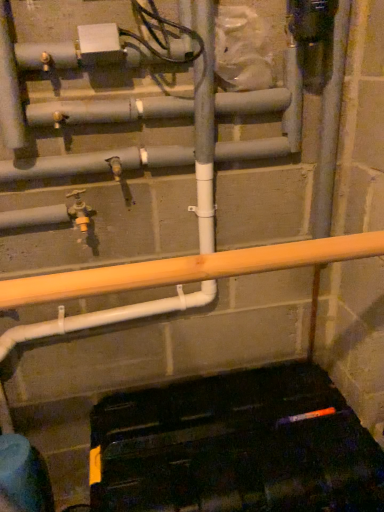
Question: Is gray matte pipe at center looking in the opposite direction of gray matte pipe at center, acting as the 1th pipe starting from the bottom?

Choices:
 (A) no
 (B) yes

Answer: (B)

Question: Is gray matte pipe at center next to gray matte pipe at center, acting as the second pipe starting from the top, and touching it?

Choices:
 (A) no
 (B) yes

Answer: (A)

Question: Is gray matte pipe at center not within gray matte pipe at center, acting as the second pipe starting from the top?

Choices:
 (A) no
 (B) yes

Answer: (B)

Question: From a real-world perspective, is gray matte pipe at center on gray matte pipe at center, acting as the 1th pipe starting from the bottom?

Choices:
 (A) no
 (B) yes

Answer: (A)

Question: Is gray matte pipe at center closer to camera compared to gray matte pipe at center, acting as the second pipe starting from the top?

Choices:
 (A) no
 (B) yes

Answer: (B)

Question: Is gray matte pipe at center at the left side of gray matte pipe at center, acting as the second pipe starting from the top?

Choices:
 (A) yes
 (B) no

Answer: (B)

Question: Would you say matte gray pipe at upper center, the 2th pipe when ordered from bottom to top, contains matte yellow valve at center-left?

Choices:
 (A) no
 (B) yes

Answer: (A)

Question: Does matte gray pipe at upper center, arranged as the 1th pipe when viewed from the top, have a greater height compared to matte yellow valve at center-left?

Choices:
 (A) no
 (B) yes

Answer: (A)

Question: Can you confirm if matte gray pipe at upper center, arranged as the 1th pipe when viewed from the top, is smaller than matte yellow valve at center-left?

Choices:
 (A) no
 (B) yes

Answer: (A)

Question: From the image's perspective, is matte gray pipe at upper center, the 2th pipe when ordered from bottom to top, located beneath matte yellow valve at center-left?

Choices:
 (A) yes
 (B) no

Answer: (B)

Question: Is matte gray pipe at upper center, arranged as the 1th pipe when viewed from the top, thinner than matte yellow valve at center-left?

Choices:
 (A) yes
 (B) no

Answer: (A)

Question: Is matte gray pipe at upper center, arranged as the 1th pipe when viewed from the top, outside matte yellow valve at center-left?

Choices:
 (A) no
 (B) yes

Answer: (B)

Question: Is the surface of matte gray pipe at upper center, arranged as the 1th pipe when viewed from the top, in direct contact with gray matte pipe at center, acting as the second pipe starting from the top?

Choices:
 (A) yes
 (B) no

Answer: (A)